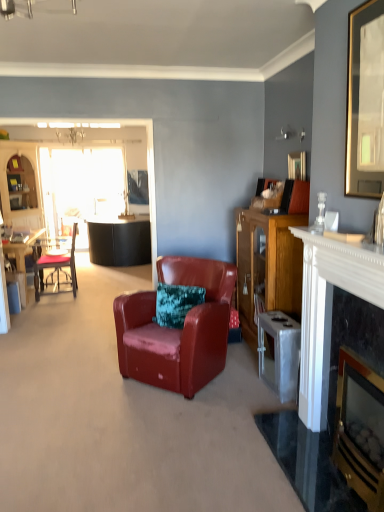
Question: Is metallic silver trash can at right positioned behind matte black chair at left, the second chair from the right?

Choices:
 (A) yes
 (B) no

Answer: (B)

Question: From a real-world perspective, is metallic silver trash can at right beneath matte black chair at left, the second chair from the right?

Choices:
 (A) yes
 (B) no

Answer: (A)

Question: Can you confirm if metallic silver trash can at right is bigger than matte black chair at left, which appears as the 1th chair when viewed from the back?

Choices:
 (A) no
 (B) yes

Answer: (A)

Question: Is metallic silver trash can at right positioned beyond the bounds of matte black chair at left, the 2th chair from the front?

Choices:
 (A) yes
 (B) no

Answer: (A)

Question: Can you confirm if metallic silver trash can at right is wider than matte black chair at left, the second chair from the right?

Choices:
 (A) no
 (B) yes

Answer: (A)

Question: Is metallic silver trash can at right facing away from matte black chair at left, the second chair from the right?

Choices:
 (A) yes
 (B) no

Answer: (B)

Question: Is wooden cabinet at right not within black marble fireplace at right, the first fireplace from the right?

Choices:
 (A) yes
 (B) no

Answer: (A)

Question: Can you confirm if wooden cabinet at right is wider than black marble fireplace at right, the first fireplace from the right?

Choices:
 (A) no
 (B) yes

Answer: (B)

Question: Are wooden cabinet at right and black marble fireplace at right, which is counted as the 2th fireplace, starting from the left, beside each other?

Choices:
 (A) no
 (B) yes

Answer: (A)

Question: Would you say wooden cabinet at right contains black marble fireplace at right, which is counted as the 2th fireplace, starting from the left?

Choices:
 (A) yes
 (B) no

Answer: (B)

Question: Considering the relative sizes of wooden cabinet at right and black marble fireplace at right, the first fireplace from the right, in the image provided, is wooden cabinet at right shorter than black marble fireplace at right, the first fireplace from the right,?

Choices:
 (A) yes
 (B) no

Answer: (B)

Question: From the image's perspective, would you say wooden cabinet at right is positioned over black marble fireplace at right, the first fireplace from the right?

Choices:
 (A) no
 (B) yes

Answer: (B)

Question: Is marble fireplace at right, which is counted as the second fireplace, starting from the right, to the right of black leather sofa at left, positioned as the 2th entertainment center in left-to-right order, from the viewer's perspective?

Choices:
 (A) yes
 (B) no

Answer: (A)